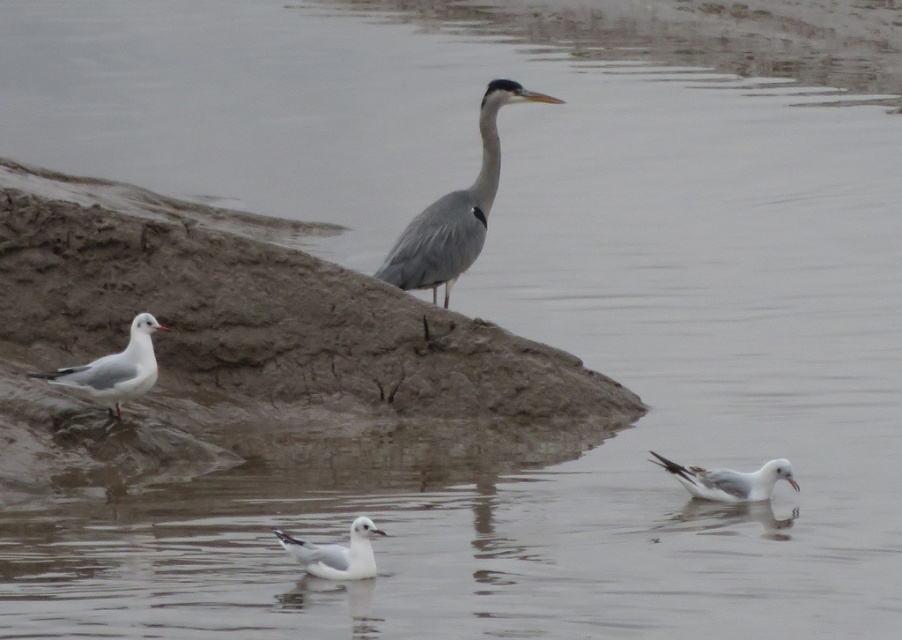
Does gray matte heron at center have a lesser width compared to white matte seagull at lower right?

In fact, gray matte heron at center might be wider than white matte seagull at lower right.

Does gray matte heron at center appear under white matte seagull at lower right?

Actually, gray matte heron at center is above white matte seagull at lower right.

Identify the location of gray matte heron at center. The image size is (902, 640). (456, 211).

How much distance is there between gray matte heron at center and white matte seagull at lower left?

A distance of 1.39 meters exists between gray matte heron at center and white matte seagull at lower left.

From the picture: Who is higher up, gray matte heron at center or white matte seagull at lower left?

Positioned higher is gray matte heron at center.

Is point (486, 205) less distant than point (53, 381)?

No, (486, 205) is further to viewer.

This screenshot has height=640, width=902. In order to click on gray matte heron at center in this screenshot , I will do `click(456, 211)`.

From the picture: Between white matte seagull at lower right and white matte seagull at center, which one is positioned lower?

white matte seagull at center

Is point (723, 483) farther from viewer compared to point (350, 528)?

Yes, point (723, 483) is farther from viewer.

Is point (778, 464) positioned in front of point (291, 540)?

No, it is behind (291, 540).

Identify the location of white matte seagull at lower right. Image resolution: width=902 pixels, height=640 pixels. (729, 480).